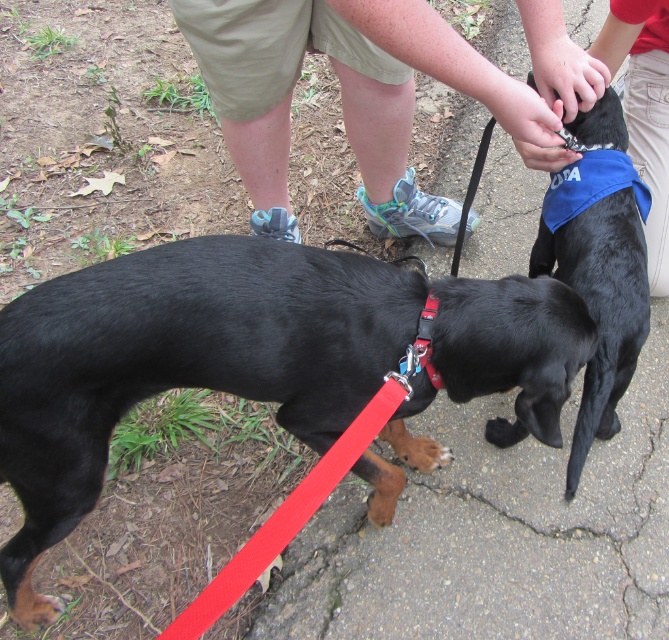
Question: Is black smooth dog at center to the right of blue fabric dog at center from the viewer's perspective?

Choices:
 (A) no
 (B) yes

Answer: (A)

Question: Is black smooth dog at center to the left of tan/khaki shorts at center from the viewer's perspective?

Choices:
 (A) yes
 (B) no

Answer: (A)

Question: Which object is the farthest from the black smooth dog at center?

Choices:
 (A) blue fabric dog bandana at center
 (B) tan/khaki shorts at center
 (C) blue fabric neckband at center-right
 (D) blue fabric dog at center

Answer: (A)

Question: Among these points, which one is farthest from the camera?

Choices:
 (A) (177, 292)
 (B) (652, 161)
 (C) (573, 186)

Answer: (B)

Question: Is tan/khaki shorts at center thinner than blue fabric neckband at center-right?

Choices:
 (A) yes
 (B) no

Answer: (B)

Question: Among these points, which one is farthest from the camera?

Choices:
 (A) (272, 80)
 (B) (585, 129)
 (C) (0, 468)
 (D) (660, 244)

Answer: (D)